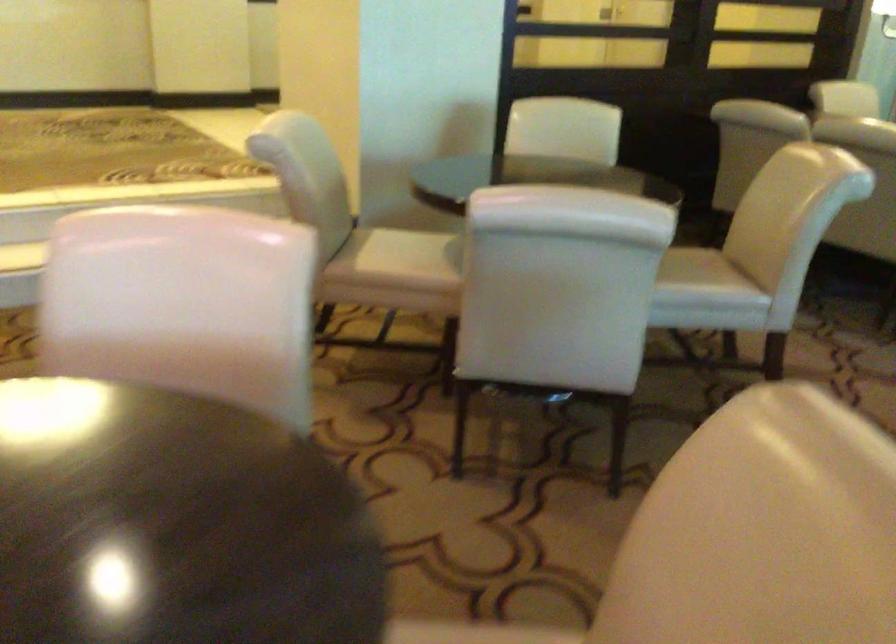
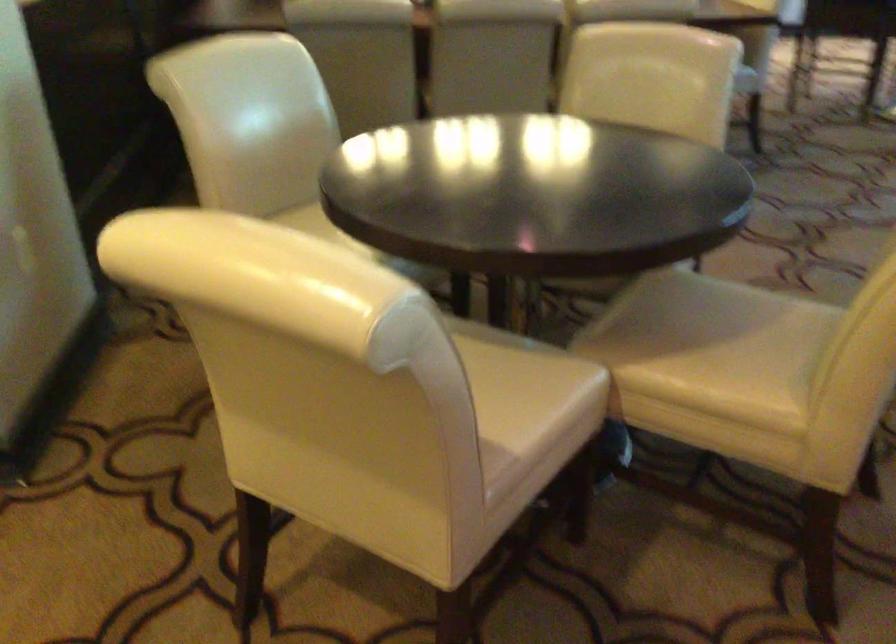
The point at (x=435, y=263) is marked in the first image. Where is the corresponding point in the second image?

(530, 377)